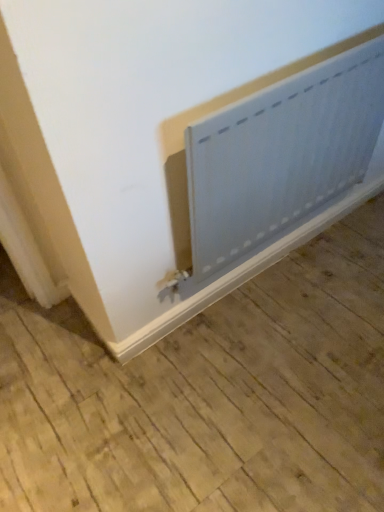
Question: Is white matte radiator at lower center taller than matte gray radiator at lower right?

Choices:
 (A) yes
 (B) no

Answer: (A)

Question: Is white matte radiator at lower center facing away from matte gray radiator at lower right?

Choices:
 (A) no
 (B) yes

Answer: (A)

Question: Is there a large distance between white matte radiator at lower center and matte gray radiator at lower right?

Choices:
 (A) no
 (B) yes

Answer: (A)

Question: Can you confirm if white matte radiator at lower center is positioned to the left of matte gray radiator at lower right?

Choices:
 (A) yes
 (B) no

Answer: (B)

Question: Would you say white matte radiator at lower center is outside matte gray radiator at lower right?

Choices:
 (A) yes
 (B) no

Answer: (A)

Question: Does white matte radiator at lower center lie in front of matte gray radiator at lower right?

Choices:
 (A) no
 (B) yes

Answer: (A)

Question: Does matte gray radiator at lower right lie in front of white matte radiator at lower center?

Choices:
 (A) no
 (B) yes

Answer: (B)

Question: Does matte gray radiator at lower right lie behind white matte radiator at lower center?

Choices:
 (A) no
 (B) yes

Answer: (A)

Question: From the image's perspective, is matte gray radiator at lower right located above white matte radiator at lower center?

Choices:
 (A) no
 (B) yes

Answer: (A)

Question: Can you confirm if matte gray radiator at lower right is positioned to the left of white matte radiator at lower center?

Choices:
 (A) no
 (B) yes

Answer: (B)

Question: Considering the relative sizes of matte gray radiator at lower right and white matte radiator at lower center in the image provided, is matte gray radiator at lower right taller than white matte radiator at lower center?

Choices:
 (A) no
 (B) yes

Answer: (A)

Question: From a real-world perspective, is matte gray radiator at lower right on top of white matte radiator at lower center?

Choices:
 (A) yes
 (B) no

Answer: (B)

Question: In the image, is white matte radiator at lower center on the left side or the right side of matte gray radiator at lower right?

Choices:
 (A) right
 (B) left

Answer: (A)